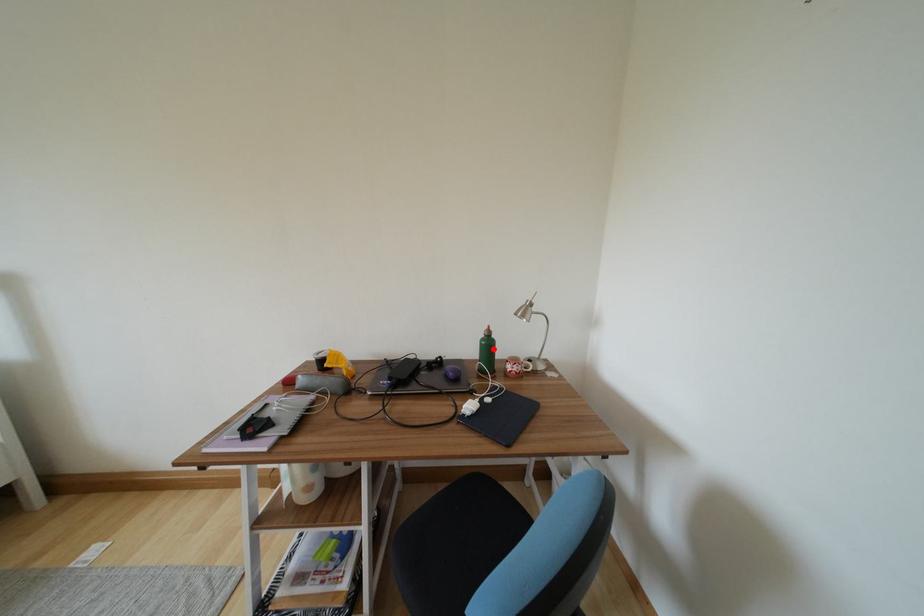
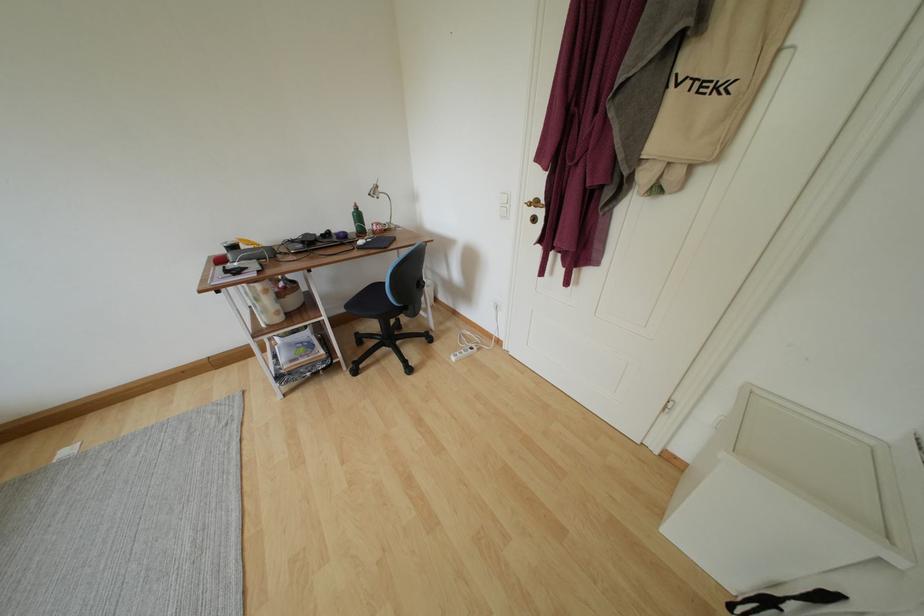
Question: I am providing you with two images of the same scene from different viewpoints. Image1 has a red point marked. In image2, the corresponding 3D location appears at what relative position? Reply with the corresponding letter.

Choices:
 (A) Closer
 (B) Farther

Answer: (A)